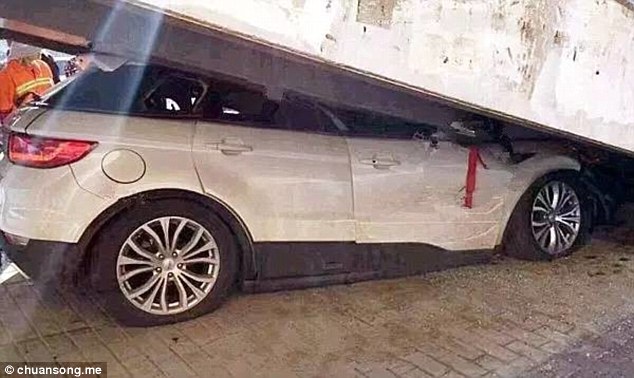
Where is `back right window`? The image size is (634, 378). back right window is located at coordinates (243, 106).